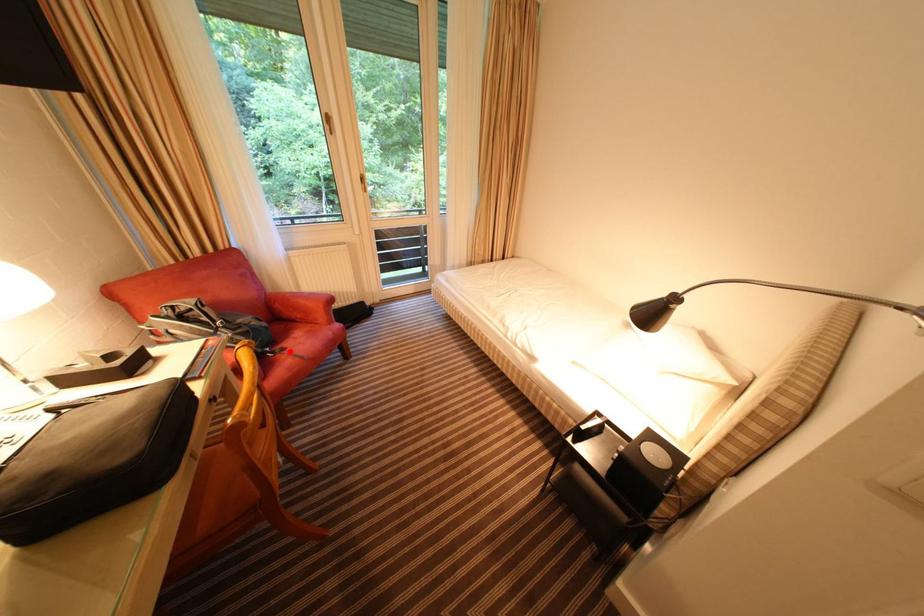
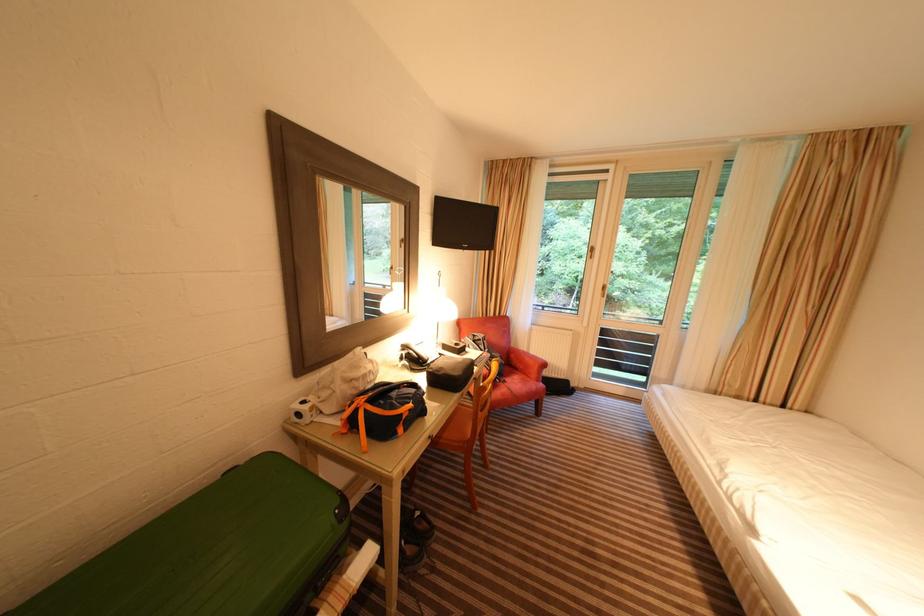
In the second image, find the point that corresponds to the highlighted location in the first image.

(512, 384)